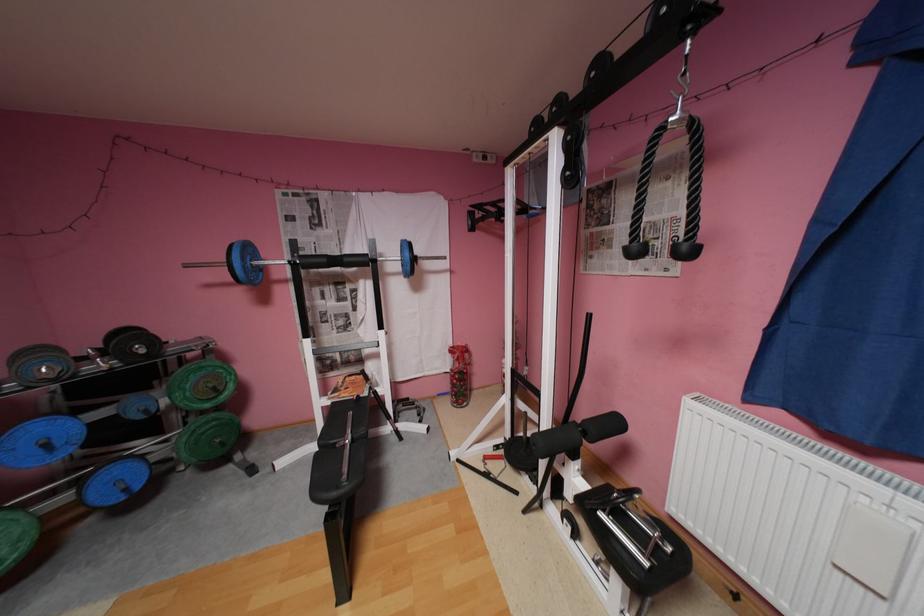
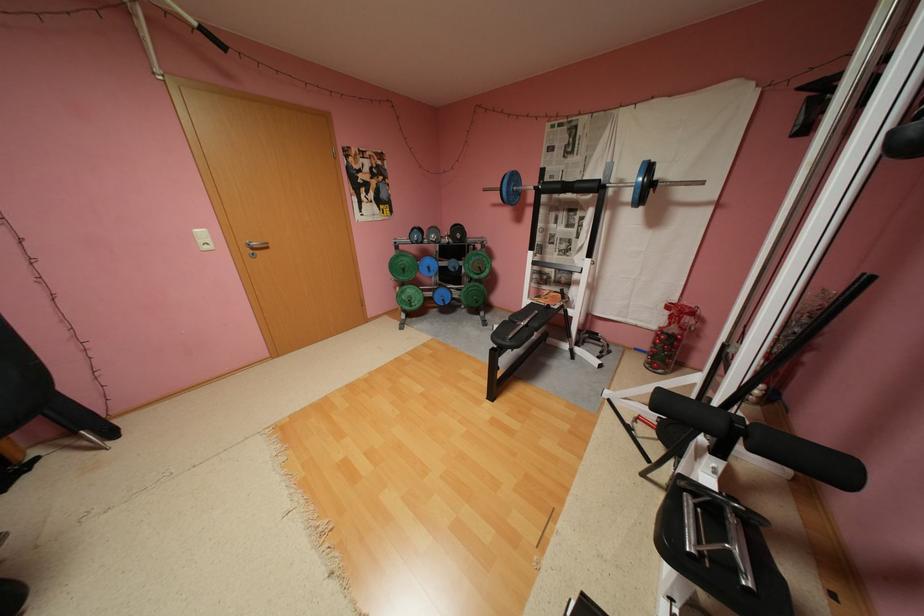
Where in the second image is the point corresponding to the point at 181,469 from the first image?

(468, 306)